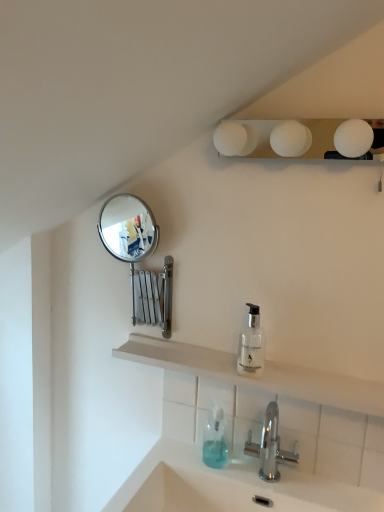
You are a GUI agent. You are given a task and a screenshot of the screen. Output one action in this format:
    pyautogui.click(x=<x>, y=<y>)
    Task: Click on the spots to the right of chrome metallic faucet at lower center
    The width and height of the screenshot is (384, 512).
    Given the screenshot: What is the action you would take?
    pyautogui.click(x=327, y=490)